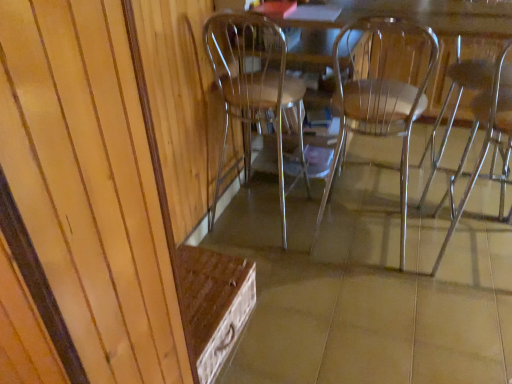
Question: Is clear plastic chair at center, arranged as the 1th chair when viewed from the left, bigger or smaller than clear plastic chair at center, which is the second chair from left to right?

Choices:
 (A) small
 (B) big

Answer: (A)

Question: From a real-world perspective, is clear plastic chair at center, arranged as the 1th chair when viewed from the left, positioned above or below clear plastic chair at center, which is the second chair from left to right?

Choices:
 (A) below
 (B) above

Answer: (A)

Question: Considering the real-world distances, which object is closest to the clear plastic chair at center, which is the 3th chair from left to right?

Choices:
 (A) clear plastic chair at right, positioned as the 1th chair in right-to-left order
 (B) clear plastic chair at center, arranged as the 1th chair when viewed from the left
 (C) clear plastic chair at center, which is the second chair from left to right

Answer: (A)

Question: Which is farther from the clear plastic chair at center, the fourth chair when ordered from right to left?

Choices:
 (A) clear plastic chair at right, which is counted as the 4th chair, starting from the left
 (B) clear plastic chair at center, which is the 3th chair from left to right
 (C) clear plastic chair at center, the third chair viewed from the right

Answer: (A)